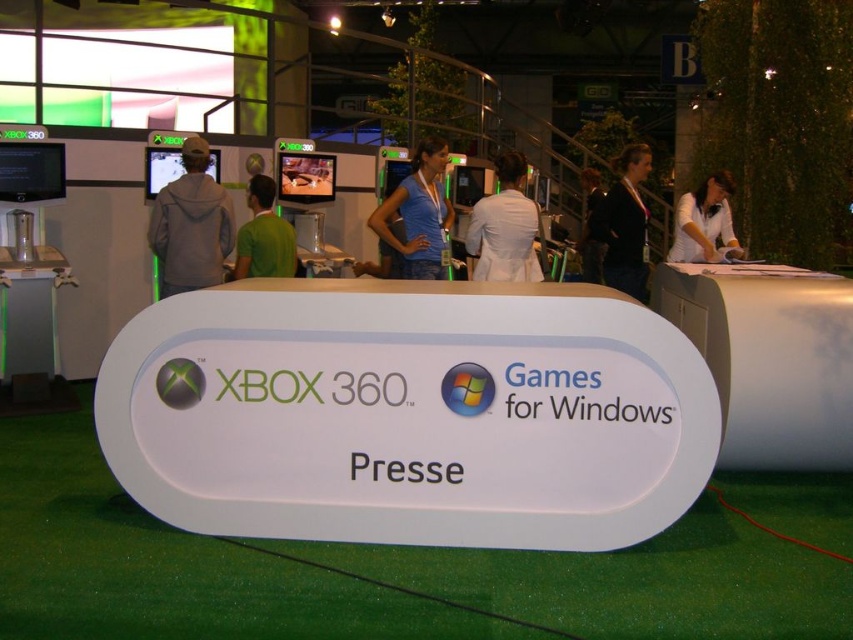
Which of these two, white plastic sign at center or light blue shirt at center, stands taller?

white plastic sign at center is taller.

Does white plastic sign at center have a lesser width compared to light blue shirt at center?

No, white plastic sign at center is not thinner than light blue shirt at center.

Does point (218, 481) come closer to viewer compared to point (595, 244)?

Yes, it is.

You are a GUI agent. You are given a task and a screenshot of the screen. Output one action in this format:
    pyautogui.click(x=<x>, y=<y>)
    Task: Click on the white plastic sign at center
    This screenshot has width=853, height=640.
    Given the screenshot: What is the action you would take?
    pyautogui.click(x=410, y=416)

What are the coordinates of `light blue shirt at center` in the screenshot? It's located at (590, 227).

Which is more to the left, light blue shirt at center or metallic xbox logo at center?

Positioned to the left is metallic xbox logo at center.

Who is more forward, (x=590, y=253) or (x=186, y=401)?

Positioned in front is point (x=186, y=401).

This screenshot has width=853, height=640. Find the location of `light blue shirt at center`. light blue shirt at center is located at coordinates click(x=590, y=227).

Who is more distant from viewer, (444, 166) or (699, 230)?

The point (699, 230) is more distant.

How distant is blue cotton shirt at center from white cloth at center?

blue cotton shirt at center and white cloth at center are 1.79 meters apart.

Is point (369, 224) positioned before point (676, 240)?

Yes.

Find the location of `blue cotton shirt at center`. blue cotton shirt at center is located at coordinates (418, 212).